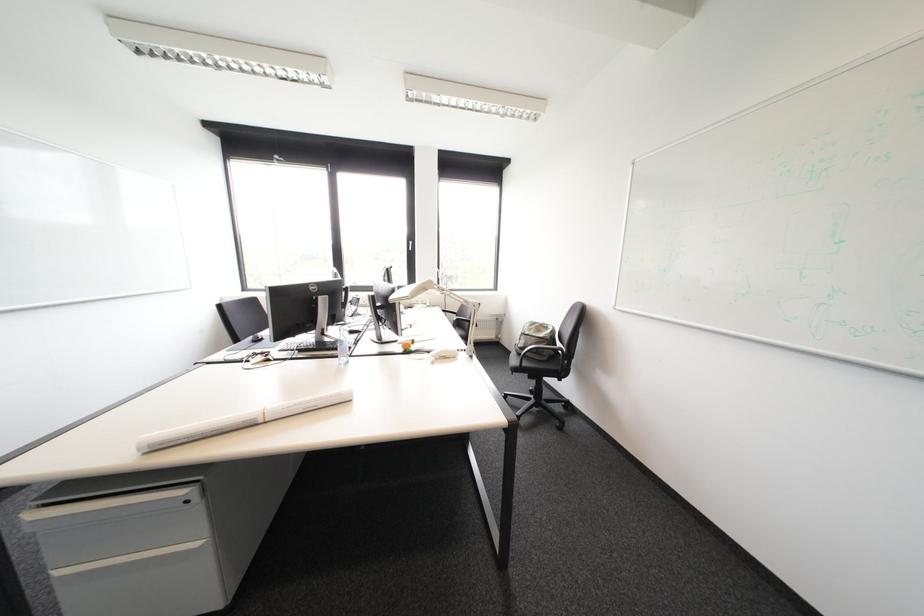
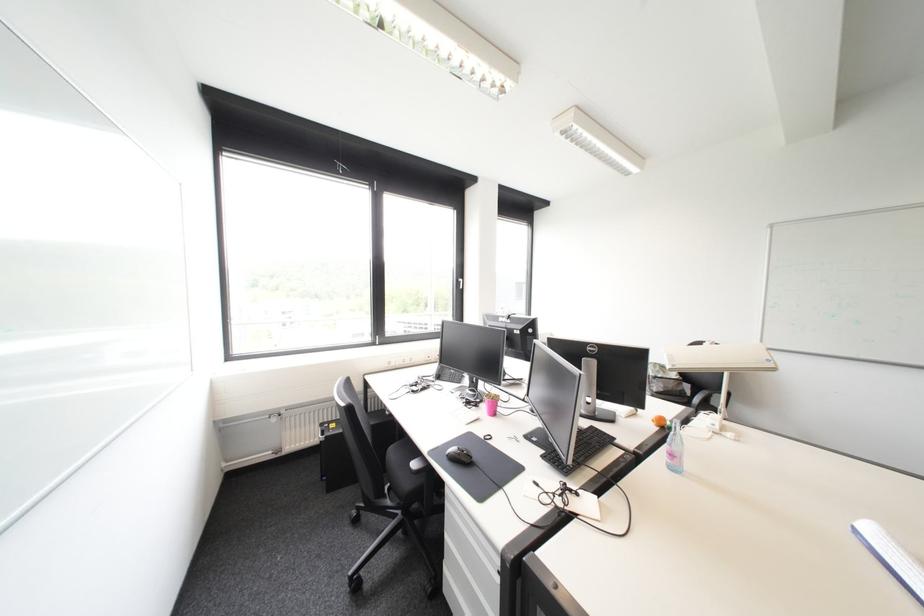
Which direction would the cameraman need to move to produce the second image?

The movement direction of the cameraman is left, forward.